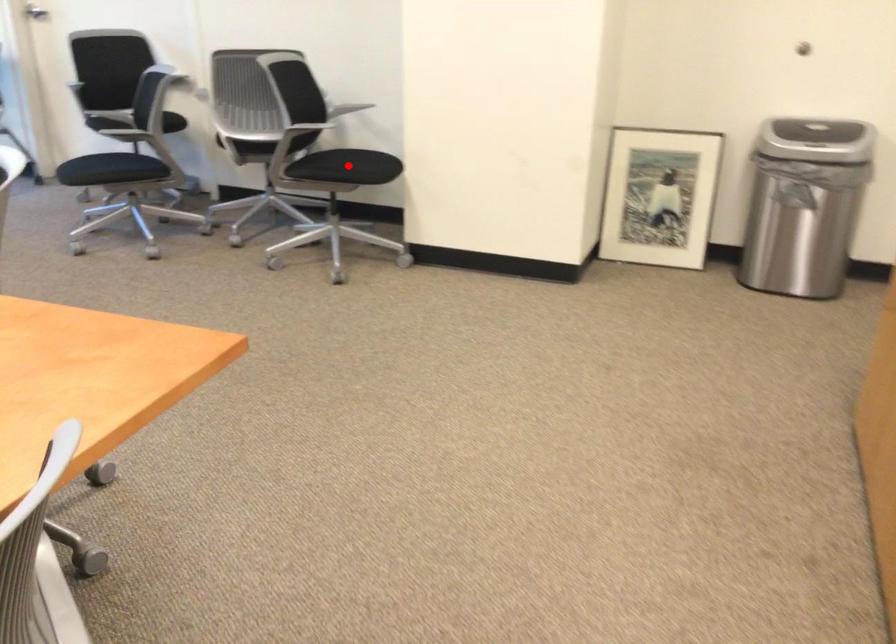
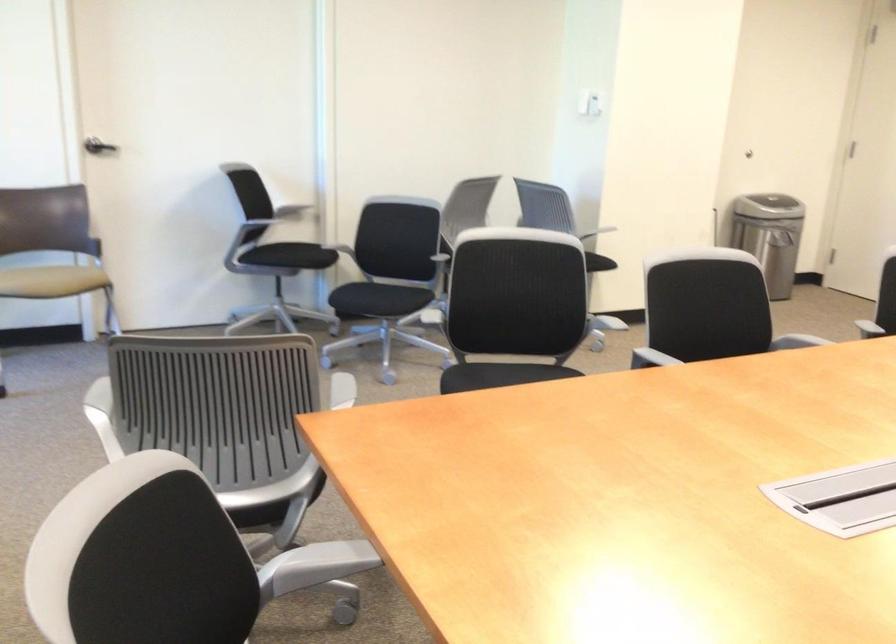
Question: I am providing you with two images of the same scene from different viewpoints. A red point is marked on the first image. Is the red point's position out of view in image 2?

Choices:
 (A) Yes
 (B) No

Answer: (A)